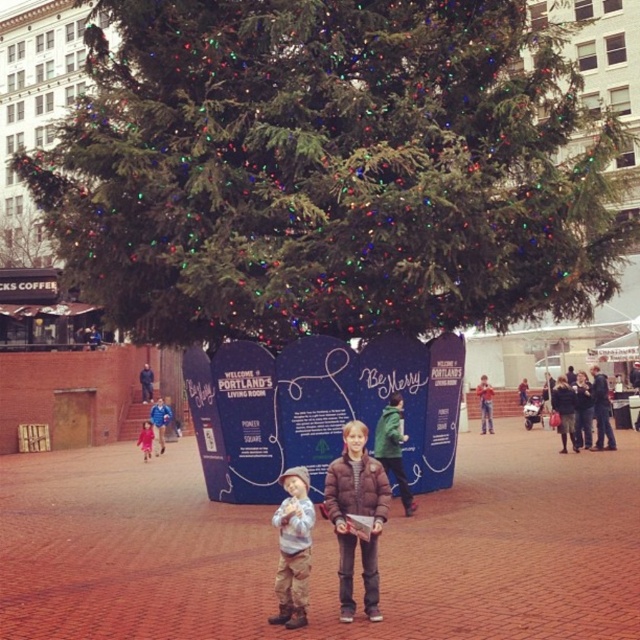
Who is positioned more to the left, green textured christmas tree at upper center or brown textured jacket at center?

green textured christmas tree at upper center

Who is more distant from viewer, [321,29] or [378,493]?

The point [321,29] is more distant.

Identify the location of green textured christmas tree at upper center. (333, 168).

Measure the distance between point (579, 394) and camera.

Point (579, 394) is 41.87 meters away from camera.

Is point (589, 422) positioned before point (148, 445)?

Yes, point (589, 422) is closer to viewer.

This screenshot has width=640, height=640. Identify the location of dark brown leather jacket at center. (582, 410).

Is green textured christmas tree at upper center positioned before matte pink coat at left?

Yes, green textured christmas tree at upper center is closer to the viewer.

Does green textured christmas tree at upper center have a lesser height compared to matte pink coat at left?

No.

Does point (132, 38) come farther from viewer compared to point (150, 426)?

No, it is not.

The height and width of the screenshot is (640, 640). Identify the location of green textured christmas tree at upper center. (333, 168).